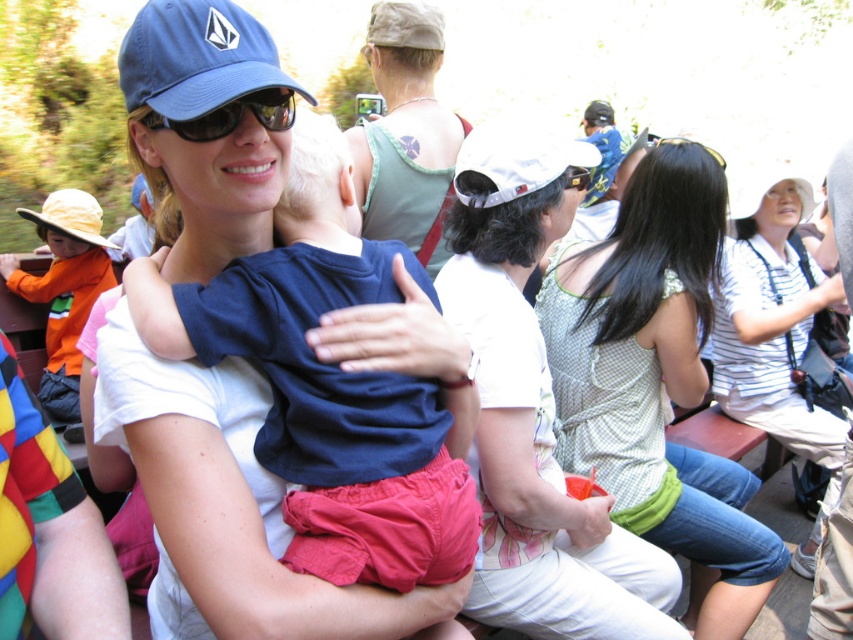
Question: Which point is closer to the camera taking this photo?

Choices:
 (A) (241, 282)
 (B) (432, 257)

Answer: (A)

Question: Which of these objects is positioned farthest from the blue fabric baseball cap at upper left?

Choices:
 (A) light green textured top at center
 (B) black reflective sunglasses at center

Answer: (A)

Question: Is green fabric tank top at upper center thinner than yellow fabric baseball hat at left?

Choices:
 (A) no
 (B) yes

Answer: (B)

Question: Does blue fabric baseball cap at upper left appear on the left side of yellow fabric baseball hat at left?

Choices:
 (A) no
 (B) yes

Answer: (A)

Question: Which of the following is the farthest from the observer?

Choices:
 (A) (582, 188)
 (B) (180, 122)
 (C) (65, 272)
 (D) (445, 458)

Answer: (C)

Question: Does light green textured tank top at center appear on the left side of black plastic goggles at upper center?

Choices:
 (A) no
 (B) yes

Answer: (A)